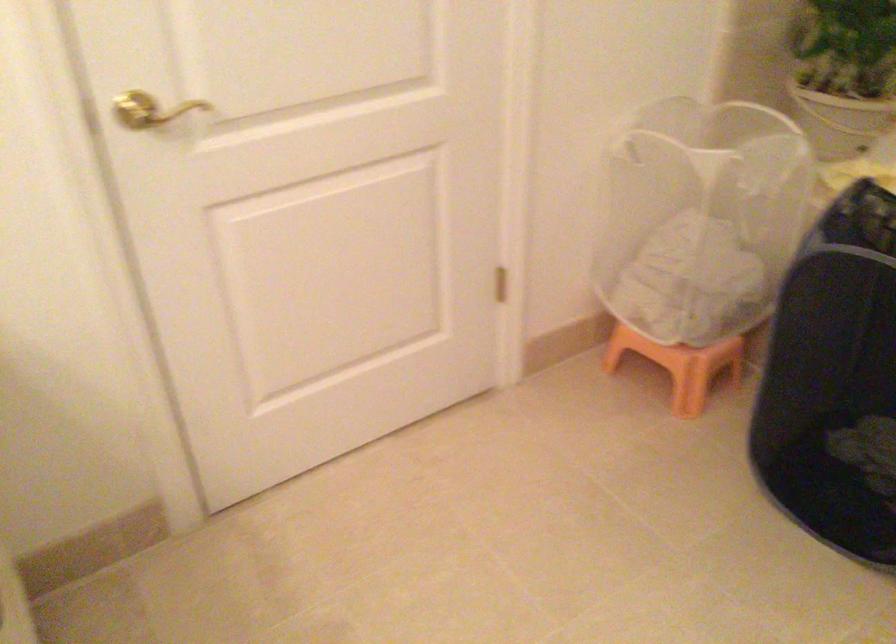
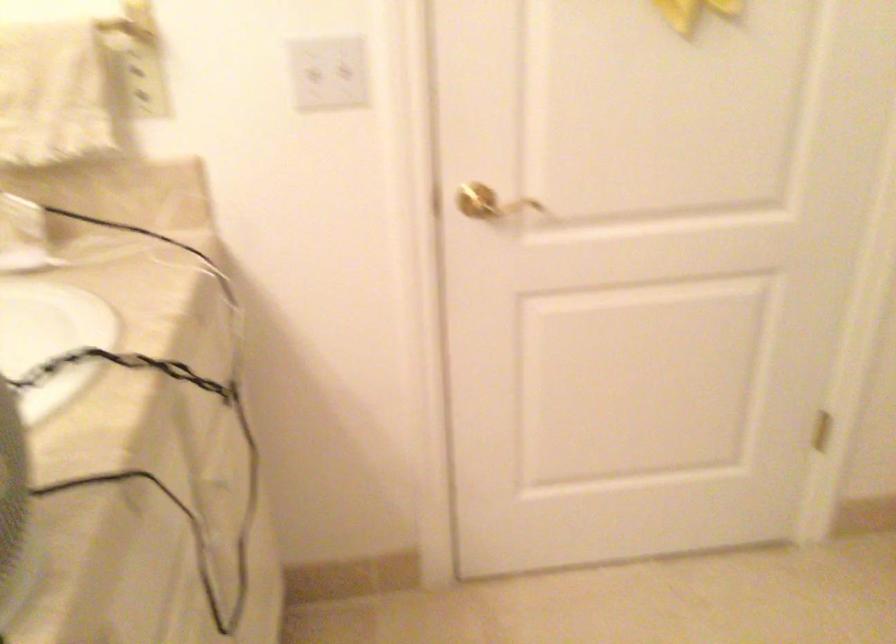
Find the pixel in the second image that matches (159,118) in the first image.

(489, 203)